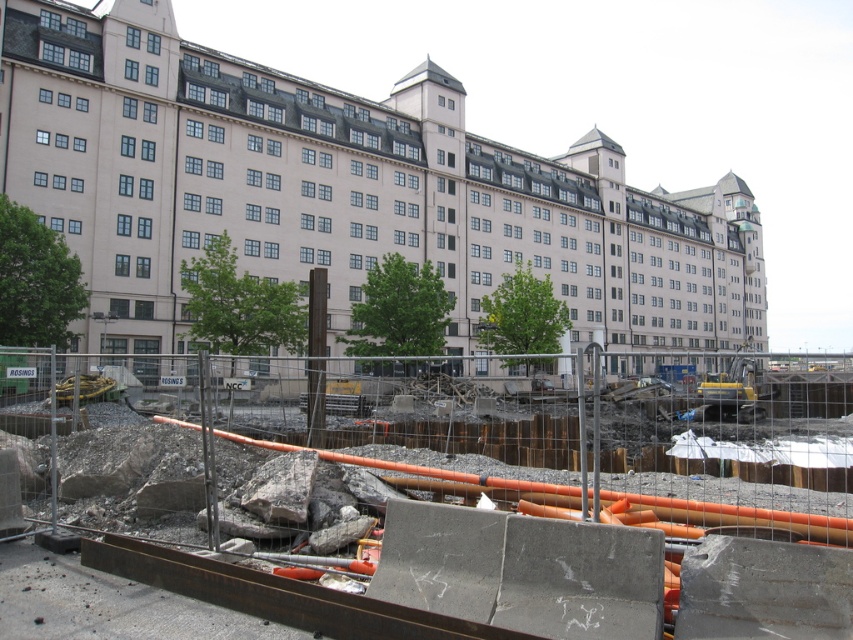
You are a construction worker standing at the entrance of the building. You need to reach a specific point marked at coordinates point (521, 433) on the construction site. Given that the distance from your current position to that point is 76.19 feet, can you safely walk there without needing any special equipment?

The distance from your current position to point (521, 433) is 76.19 feet. Since this distance is within a manageable range for walking, you can safely walk there without needing any special equipment.

You are a construction worker who needs to move a large equipment through the construction site. The equipment requires a clear path that is wider than the rusty metal pipes at center. Can you pass through the area where the light beige concrete building at center is located?

The rusty metal pipes at center occupies less space than light beige concrete building at center, so the path near the light beige concrete building at center might be narrower than the equipment requires. It is safer to choose a different route that has more space.